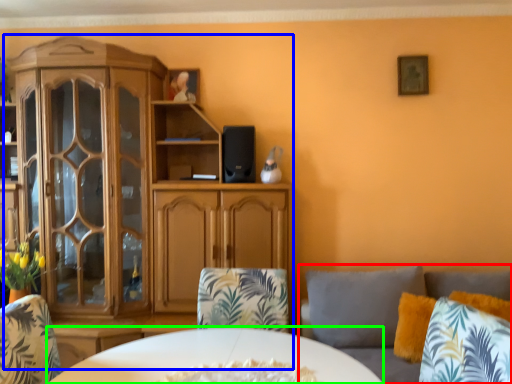
Question: Considering the real-world distances, which object is farthest from studio couch (highlighted by a red box)? cabinetry (highlighted by a blue box) or desk (highlighted by a green box)?

Choices:
 (A) cabinetry
 (B) desk

Answer: (A)